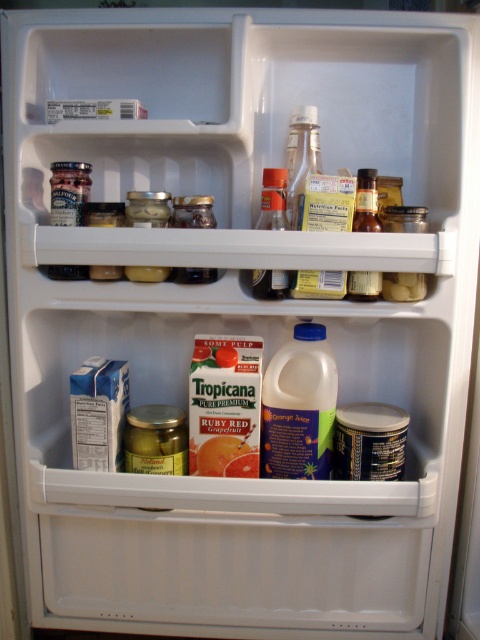
Is matte glass jar at upper left to the left of translucent plastic bottle at center from the viewer's perspective?

Correct, you'll find matte glass jar at upper left to the left of translucent plastic bottle at center.

Is matte glass jar at upper left thinner than translucent plastic bottle at center?

Incorrect, matte glass jar at upper left's width is not less than translucent plastic bottle at center's.

Image resolution: width=480 pixels, height=640 pixels. I want to click on matte glass jar at upper left, so click(x=69, y=193).

Looking at this image, does translucent plastic bottle at center have a greater width compared to translucent glass bottle at upper center?

Yes.

Does point (255, 288) come farther from viewer compared to point (351, 275)?

No, (255, 288) is in front of (351, 275).

Who is more distant from viewer, (277, 280) or (354, 289)?

Point (354, 289)

At what (x,y) coordinates should I click in order to perform the action: click on translucent plastic bottle at center. Please return your answer as a coordinate pair (x, y). This screenshot has height=640, width=480. Looking at the image, I should click on (273, 198).

What do you see at coordinates (69, 193) in the screenshot?
I see `matte glass jar at upper left` at bounding box center [69, 193].

Does matte glass jar at upper left have a smaller size compared to translucent glass bottle at upper center?

Yes, matte glass jar at upper left is smaller than translucent glass bottle at upper center.

This screenshot has height=640, width=480. I want to click on matte glass jar at upper left, so click(x=69, y=193).

Where is `matte glass jar at upper left`? matte glass jar at upper left is located at coordinates (69, 193).